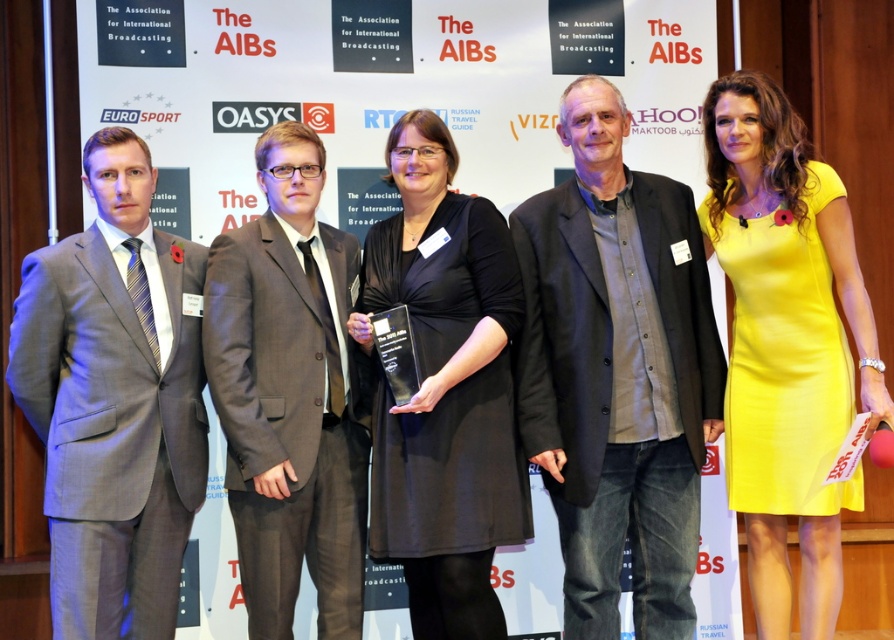
In the scene shown: In the scene described, where is the gray suit at left positioned in terms of coordinates?

The gray suit at left is positioned at coordinates 0.627 on the x axis and 0.129 on the y axis.